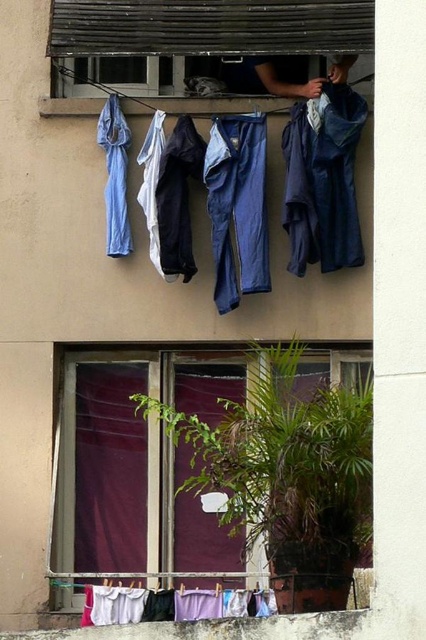
You are standing outside the building and looking at the maroon fabric curtain at lower center and the purple matte curtain at lower left. Which curtain is closer to the right side of the balcony?

The maroon fabric curtain at lower center is closer to the right side of the balcony because it is positioned on the right side of the purple matte curtain at lower left.

You are standing outside the building and want to determine which curtain is bigger between the maroon fabric curtain at lower center and the purple matte curtain at lower left. Based on the scene, which one is larger?

The maroon fabric curtain at lower center is larger compared to the purple matte curtain at lower left.

You are standing outside the building and looking at the purple matte curtain at lower left and the blue fabric pants at upper left. Which object is closer to you?

The purple matte curtain at lower left is closer to you because it is further to the viewer than the blue fabric pants at upper left.